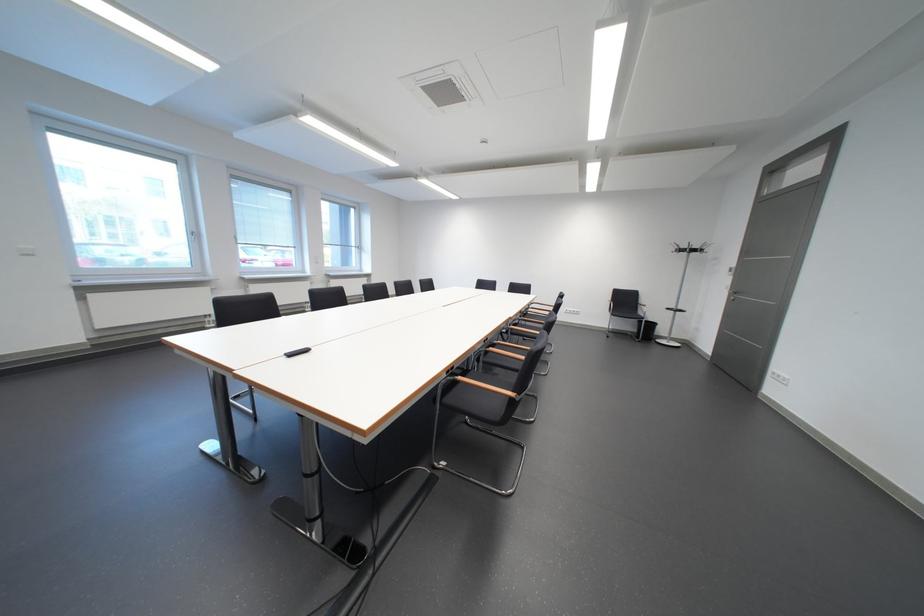
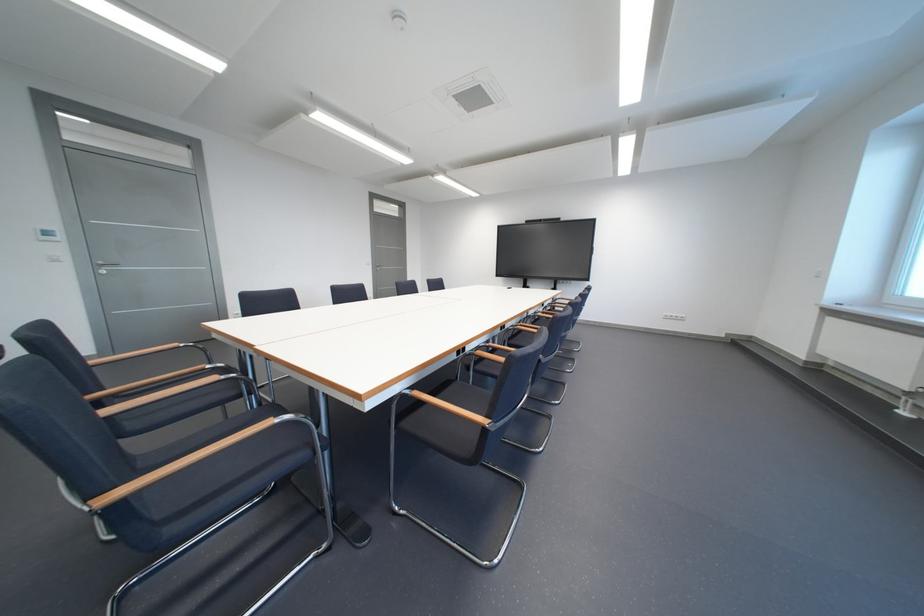
Question: I am providing you with two images of the same scene from different viewpoints. Which of the following objects are not visible in image2?

Choices:
 (A) black chair sitting surface
 (B) silver door handle
 (C) chair sitting surface
 (D) wall control switch

Answer: (A)